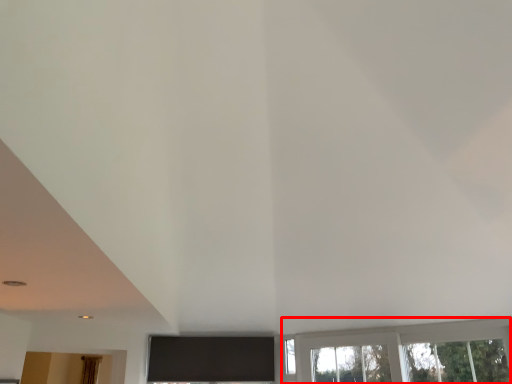
Question: Considering the relative positions of window (annotated by the red box) and curtain in the image provided, where is window (annotated by the red box) located with respect to the staircase?

Choices:
 (A) right
 (B) left

Answer: (A)